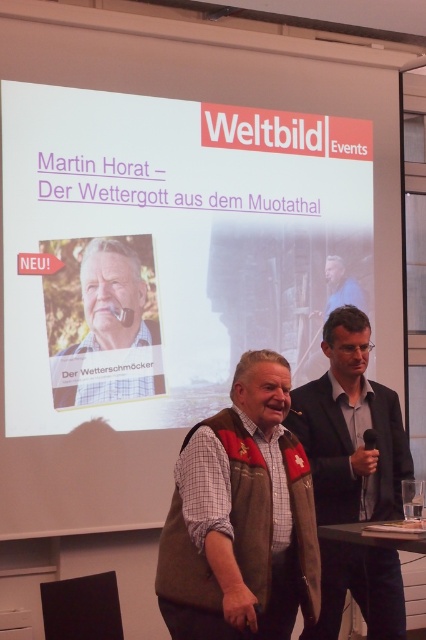
Question: Estimate the real-world distances between objects in this image. Which object is farther from the matte brown vest at center?

Choices:
 (A) white matte projector screen at upper center
 (B) brown leather vest at center
 (C) leather vest at center

Answer: (C)

Question: Which object appears farthest from the camera in this image?

Choices:
 (A) brown leather vest at center
 (B) matte brown vest at center
 (C) white matte projector screen at upper center
 (D) leather vest at center

Answer: (B)

Question: Does leather vest at center appear on the left side of brown leather vest at center?

Choices:
 (A) yes
 (B) no

Answer: (A)

Question: Does white matte projector screen at upper center appear under matte brown vest at center?

Choices:
 (A) no
 (B) yes

Answer: (A)

Question: Is leather vest at center wider than matte brown vest at center?

Choices:
 (A) no
 (B) yes

Answer: (A)

Question: Which object is positioned closest to the white matte projector screen at upper center?

Choices:
 (A) brown leather vest at center
 (B) matte brown vest at center
 (C) leather vest at center

Answer: (B)